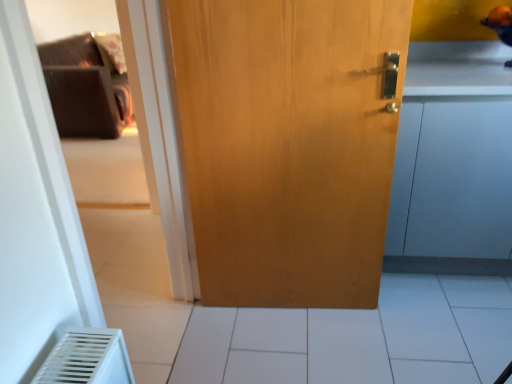
Question: Does white tile at center have a greater width compared to light brown wood door at center?

Choices:
 (A) no
 (B) yes

Answer: (B)

Question: Does white tile at center have a greater height compared to light brown wood door at center?

Choices:
 (A) yes
 (B) no

Answer: (B)

Question: Does white tile at center have a larger size compared to light brown wood door at center?

Choices:
 (A) yes
 (B) no

Answer: (A)

Question: Is white tile at center to the right of light brown wood door at center from the viewer's perspective?

Choices:
 (A) yes
 (B) no

Answer: (A)

Question: Considering the relative sizes of white tile at center and light brown wood door at center in the image provided, is white tile at center shorter than light brown wood door at center?

Choices:
 (A) no
 (B) yes

Answer: (B)

Question: Considering the positions of white tile at center and matte wood cabinet at right in the image, is white tile at center taller or shorter than matte wood cabinet at right?

Choices:
 (A) short
 (B) tall

Answer: (A)

Question: Is white tile at center inside the boundaries of matte wood cabinet at right, or outside?

Choices:
 (A) outside
 (B) inside

Answer: (A)

Question: In terms of width, does white tile at center look wider or thinner when compared to matte wood cabinet at right?

Choices:
 (A) thin
 (B) wide

Answer: (B)

Question: From the image's perspective, is white tile at center above or below matte wood cabinet at right?

Choices:
 (A) below
 (B) above

Answer: (A)

Question: Is light brown wood door at center inside the boundaries of white tile at center, or outside?

Choices:
 (A) inside
 (B) outside

Answer: (B)

Question: Considering the positions of light brown wood door at center and white tile at center in the image, is light brown wood door at center taller or shorter than white tile at center?

Choices:
 (A) short
 (B) tall

Answer: (B)

Question: In terms of width, does light brown wood door at center look wider or thinner when compared to white tile at center?

Choices:
 (A) wide
 (B) thin

Answer: (B)

Question: In terms of size, does light brown wood door at center appear bigger or smaller than white tile at center?

Choices:
 (A) big
 (B) small

Answer: (B)

Question: Is white tile at center spatially inside light brown wood door at center, or outside of it?

Choices:
 (A) outside
 (B) inside

Answer: (A)

Question: From a real-world perspective, is white tile at center above or below light brown wood door at center?

Choices:
 (A) below
 (B) above

Answer: (A)